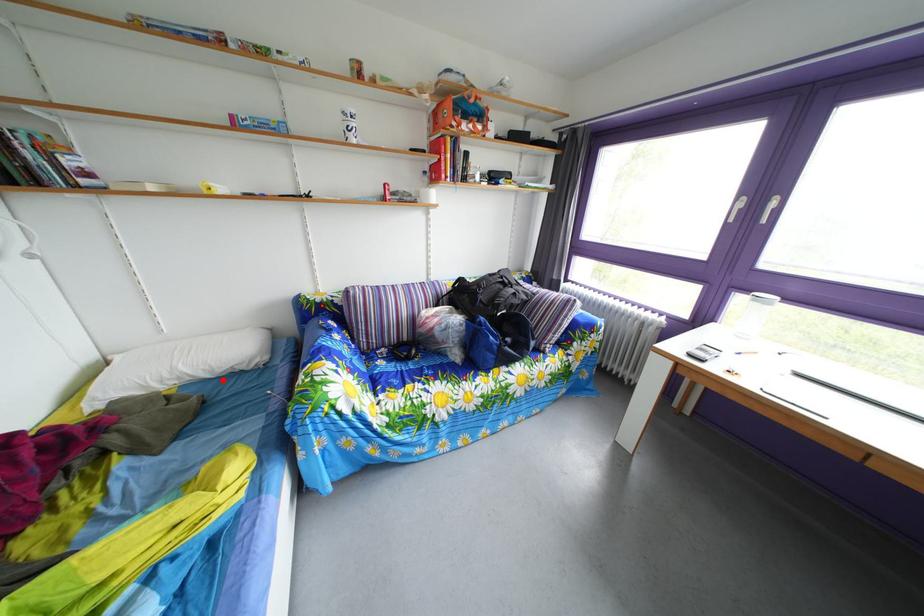
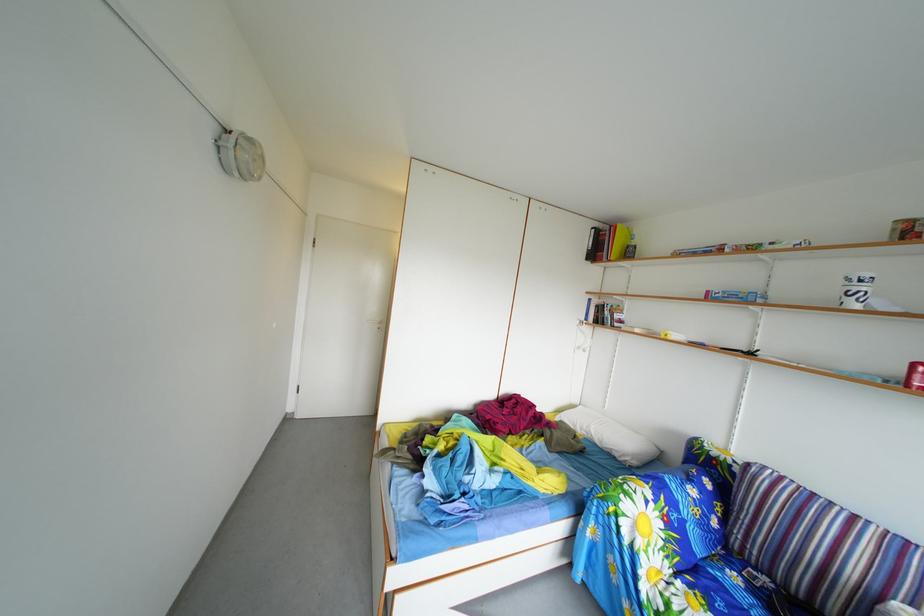
Question: I am providing you with two images of the same scene from different viewpoints. A red point is marked on the first image. Is the red point's position out of view in image 2?

Choices:
 (A) Yes
 (B) No

Answer: (B)